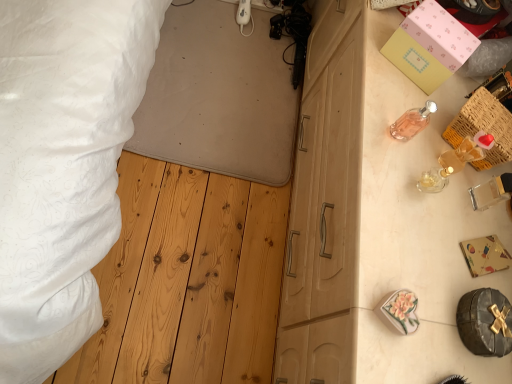
Question: Does pink glass perfume at upper right have a larger size compared to woven wood crate at upper right?

Choices:
 (A) no
 (B) yes

Answer: (A)

Question: Does pink glass perfume at upper right appear on the right side of woven wood crate at upper right?

Choices:
 (A) no
 (B) yes

Answer: (A)

Question: From the image's perspective, is pink glass perfume at upper right above woven wood crate at upper right?

Choices:
 (A) no
 (B) yes

Answer: (B)

Question: Can you confirm if pink glass perfume at upper right is shorter than woven wood crate at upper right?

Choices:
 (A) yes
 (B) no

Answer: (B)

Question: Can you confirm if pink glass perfume at upper right is taller than woven wood crate at upper right?

Choices:
 (A) yes
 (B) no

Answer: (A)

Question: Can you confirm if pink glass perfume at upper right is wider than woven wood crate at upper right?

Choices:
 (A) no
 (B) yes

Answer: (A)

Question: From the image's perspective, does woven wood crate at upper right appear lower than gold foil gift box at right, positioned as the first box in front-to-back order?

Choices:
 (A) yes
 (B) no

Answer: (B)

Question: From a real-world perspective, is woven wood crate at upper right over gold foil gift box at right, positioned as the first box in front-to-back order?

Choices:
 (A) yes
 (B) no

Answer: (A)

Question: Can you confirm if woven wood crate at upper right is positioned to the left of gold foil gift box at right, marked as the first box in a bottom-to-top arrangement?

Choices:
 (A) yes
 (B) no

Answer: (B)

Question: Considering the relative sizes of woven wood crate at upper right and gold foil gift box at right, positioned as the first box in front-to-back order, in the image provided, is woven wood crate at upper right bigger than gold foil gift box at right, positioned as the first box in front-to-back order,?

Choices:
 (A) yes
 (B) no

Answer: (A)

Question: Is woven wood crate at upper right positioned in front of gold foil gift box at right, positioned as the first box in front-to-back order?

Choices:
 (A) yes
 (B) no

Answer: (B)

Question: Does woven wood crate at upper right appear on the right side of gold foil gift box at right, positioned as the first box in front-to-back order?

Choices:
 (A) no
 (B) yes

Answer: (B)

Question: Can you confirm if pink glass perfume at upper right is wider than white textured bed at upper left?

Choices:
 (A) yes
 (B) no

Answer: (B)